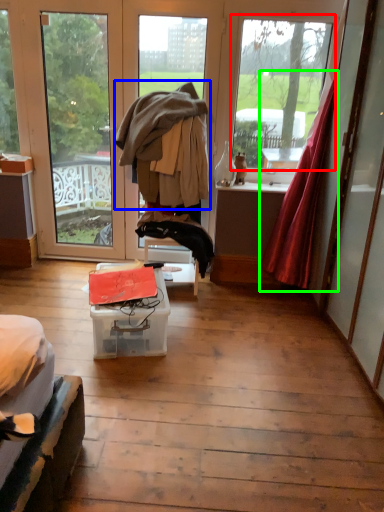
Question: Based on their relative distances, which object is farther from window (highlighted by a red box)? Choose from jacket (highlighted by a blue box) and curtain (highlighted by a green box).

Choices:
 (A) jacket
 (B) curtain

Answer: (A)